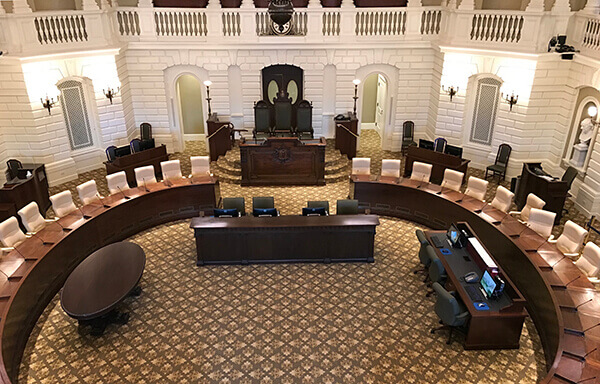
Identify the location of round wood desks. (88, 233), (517, 248).